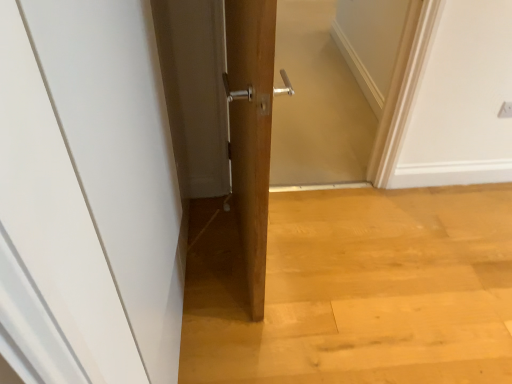
Where is `free location to the right of white matte door at center`? The height and width of the screenshot is (384, 512). free location to the right of white matte door at center is located at coordinates (312, 290).